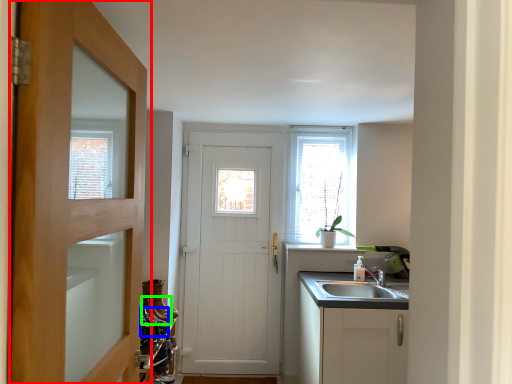
Question: Which object is positioned farthest from door (highlighted by a red box)? Select from shoe (highlighted by a blue box) and shoe (highlighted by a green box).

Choices:
 (A) shoe
 (B) shoe

Answer: (B)